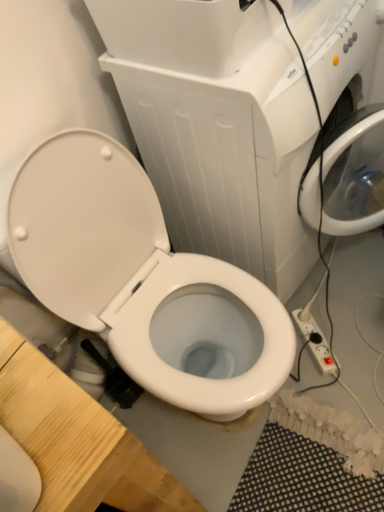
Question: Is white glossy toilet at center facing towards white glossy toilet at center?

Choices:
 (A) no
 (B) yes

Answer: (A)

Question: Considering the relative sizes of white glossy toilet at center and white glossy toilet at center in the image provided, is white glossy toilet at center smaller than white glossy toilet at center?

Choices:
 (A) yes
 (B) no

Answer: (B)

Question: Is white glossy toilet at center turned away from white glossy toilet at center?

Choices:
 (A) no
 (B) yes

Answer: (A)

Question: Is white glossy toilet at center thinner than white glossy toilet at center?

Choices:
 (A) no
 (B) yes

Answer: (B)

Question: From a real-world perspective, is white glossy toilet at center over white glossy toilet at center?

Choices:
 (A) no
 (B) yes

Answer: (B)

Question: From a real-world perspective, is white glossy toilet at center below white glossy toilet at center?

Choices:
 (A) yes
 (B) no

Answer: (B)

Question: Is white plastic power strip at lower right looking in the opposite direction of white glossy toilet at center?

Choices:
 (A) yes
 (B) no

Answer: (B)

Question: Is white glossy toilet at center completely or partially inside white plastic power strip at lower right?

Choices:
 (A) yes
 (B) no

Answer: (B)

Question: Is white plastic power strip at lower right smaller than white glossy toilet at center?

Choices:
 (A) yes
 (B) no

Answer: (A)

Question: Is white plastic power strip at lower right thinner than white glossy toilet at center?

Choices:
 (A) no
 (B) yes

Answer: (B)

Question: Considering the relative sizes of white plastic power strip at lower right and white glossy toilet at center in the image provided, is white plastic power strip at lower right bigger than white glossy toilet at center?

Choices:
 (A) yes
 (B) no

Answer: (B)

Question: From the image's perspective, is white plastic power strip at lower right located beneath white glossy toilet at center?

Choices:
 (A) yes
 (B) no

Answer: (A)

Question: Is white glossy toilet at center outside of white plastic power strip at lower right?

Choices:
 (A) no
 (B) yes

Answer: (B)